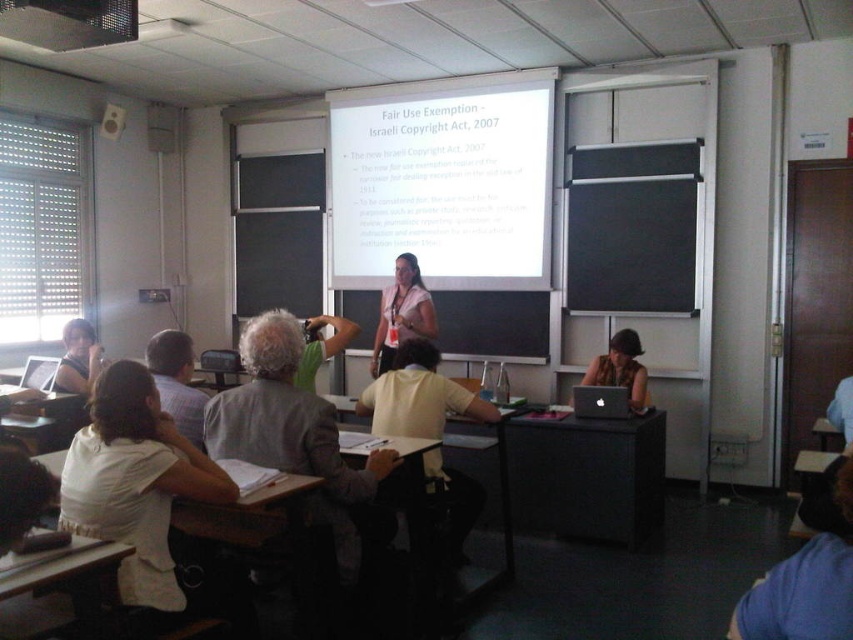
You are a student sitting at the desk in the classroom. You notice the white matte projection screen at upper center and the matte black shirt at left. Which object is higher in the image?

The white matte projection screen at upper center is higher than the matte black shirt at left.

You are a photographer standing at the back of the classroom. You want to take a photo of the white cotton shirt at lower left and the matte black shirt at left. The camera you are using has a minimum focus distance of 8 feet. Will you be able to capture both shirts clearly in the same photo without moving closer?

The distance between the white cotton shirt at lower left and the matte black shirt at left is 7.88 feet, which is less than the camera minimum focus distance of 8 feet. Therefore, you can capture both shirts clearly in the same photo without moving closer.

You are standing at the back of the classroom and want to read the text displayed on the white matte projection screen at upper center. The recommended viewing distance for such screens is 5 meters. Can you comfortably read the text from your current position?

The white matte projection screen at upper center is 5.39 meters away from you. Since the recommended viewing distance is 5 meters, you are slightly farther than the recommended distance. This might make it a bit challenging to read the text comfortably from your current position.